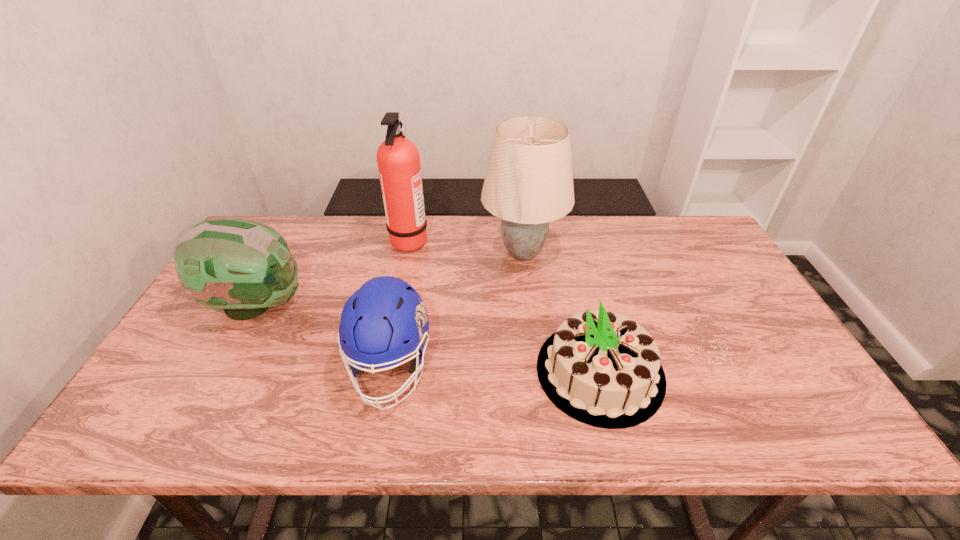
The image size is (960, 540). Find the location of `lampshade that is at the far edge`. lampshade that is at the far edge is located at coordinates (529, 182).

The image size is (960, 540). I want to click on football helmet that is at the near edge, so click(x=385, y=321).

You are a GUI agent. You are given a task and a screenshot of the screen. Output one action in this format:
    pyautogui.click(x=<x>, y=<y>)
    Task: Click on the birthday cake positioned at the near edge
    
    Given the screenshot: What is the action you would take?
    pyautogui.click(x=603, y=369)

Where is `object at the left edge`? object at the left edge is located at coordinates (244, 267).

Find the location of a particular element. vacant space at the far edge of the desktop is located at coordinates (571, 259).

This screenshot has width=960, height=540. In the image, there is a desktop. In order to click on free space at the near edge in this screenshot , I will do `click(400, 433)`.

Find the location of a particular element. The height and width of the screenshot is (540, 960). vacant position at the right edge of the desktop is located at coordinates (732, 297).

The width and height of the screenshot is (960, 540). What are the coordinates of `free region at the far right corner` in the screenshot? It's located at (697, 223).

Find the location of a particular element. Image resolution: width=960 pixels, height=540 pixels. free location at the near right corner is located at coordinates (816, 419).

Find the location of a particular element. The width and height of the screenshot is (960, 540). free area in between the left football helmet and the right football helmet is located at coordinates [324, 336].